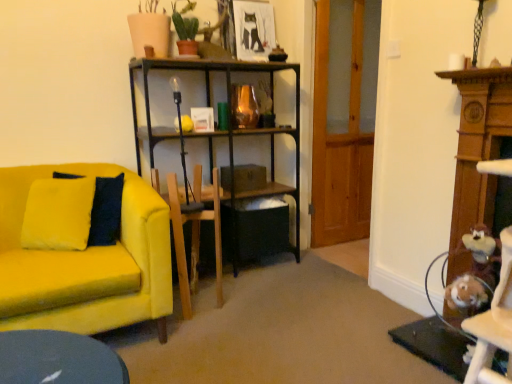
Where is `free location to the right of wooden swivel chair at center`? Image resolution: width=512 pixels, height=384 pixels. free location to the right of wooden swivel chair at center is located at coordinates (243, 301).